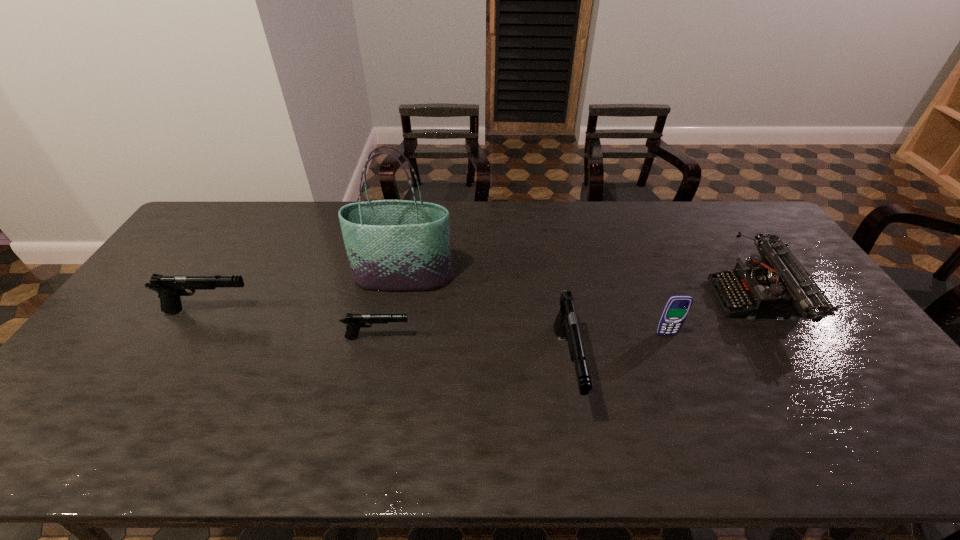
Where is `free space located 0.220m on the front-facing side of the second object from right to left`? free space located 0.220m on the front-facing side of the second object from right to left is located at coordinates (695, 408).

Find the location of a particular element. free space located on the front of the tallest object is located at coordinates point(386,370).

Locate an element on the screen. This screenshot has height=540, width=960. vacant area situated 0.350m on the keyboard of the typewriter is located at coordinates (598, 301).

This screenshot has height=540, width=960. I want to click on vacant position located 0.070m on the keyboard of the typewriter, so click(x=692, y=301).

This screenshot has width=960, height=540. I want to click on vacant region located on the keyboard of the typewriter, so click(591, 301).

Locate an element on the screen. object that is at the near edge is located at coordinates click(x=566, y=324).

Find the location of a particular element. Image resolution: width=960 pixels, height=540 pixels. object located in the left edge section of the desktop is located at coordinates (169, 287).

This screenshot has width=960, height=540. What are the coordinates of `object located in the right edge section of the desktop` in the screenshot? It's located at (774, 285).

What are the coordinates of `vacant area at the far edge` in the screenshot? It's located at [x=259, y=225].

Find the location of a particular element. vacant space at the near edge of the desktop is located at coordinates (451, 390).